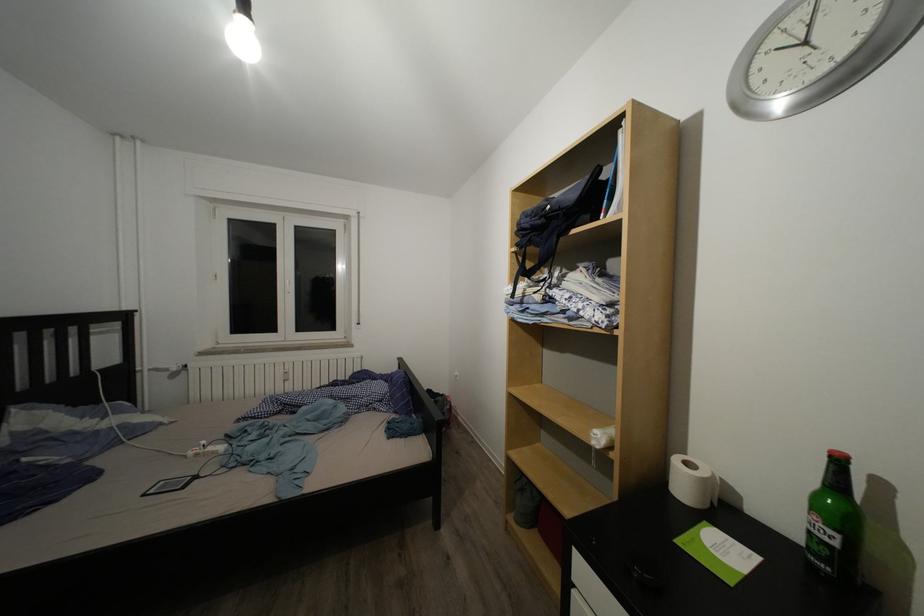
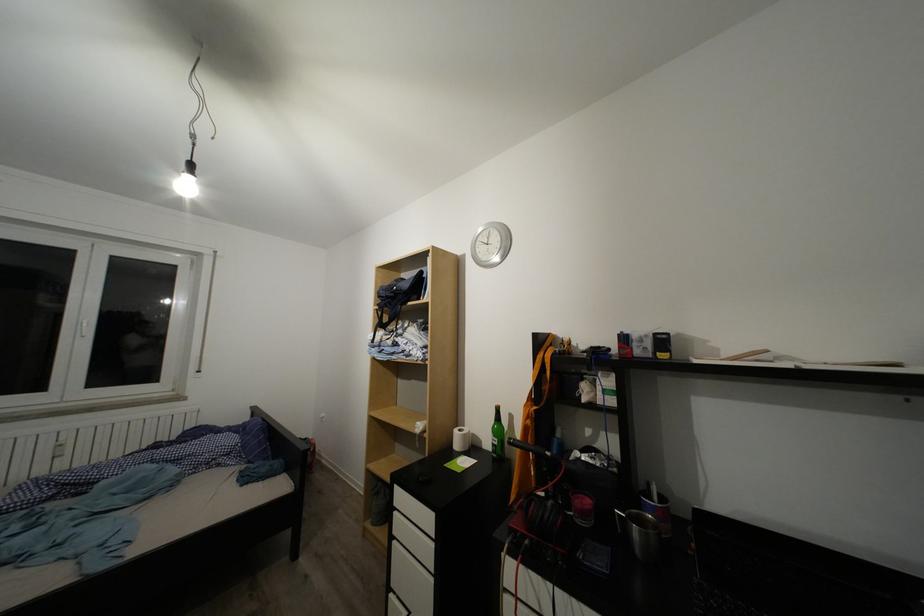
In the second image, find the point that corresponds to (298,286) in the first image.

(90, 325)